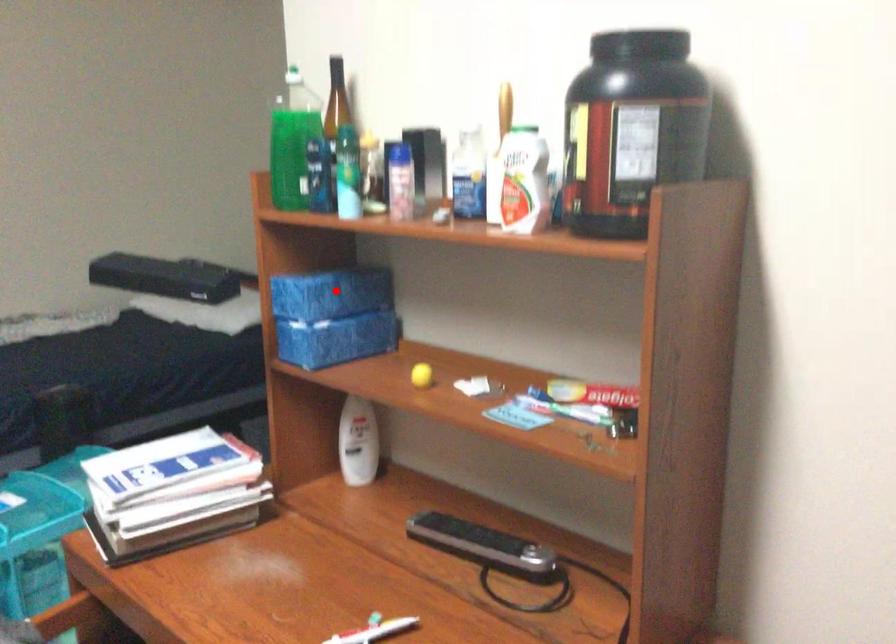
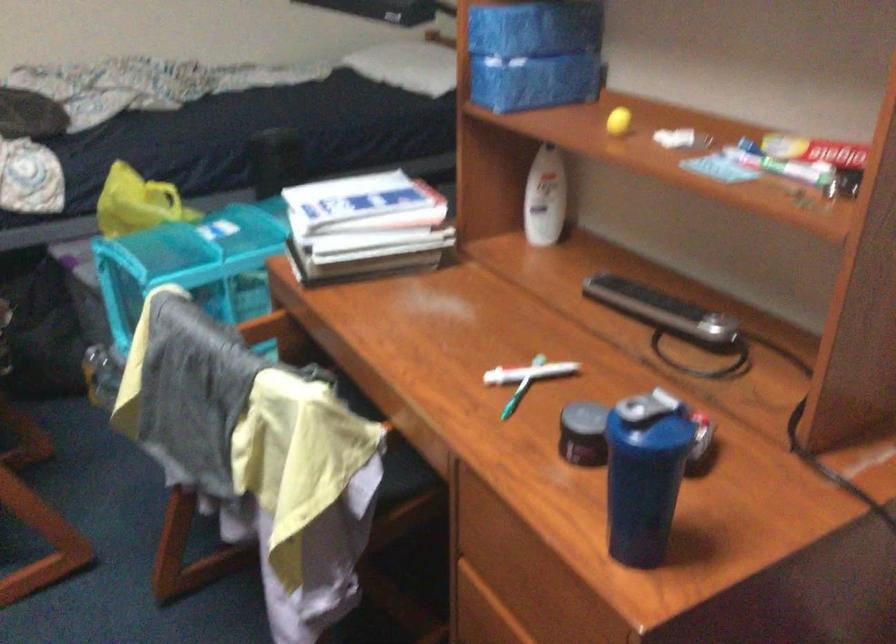
In the second image, find the point that corresponds to the highlighted location in the first image.

(536, 26)